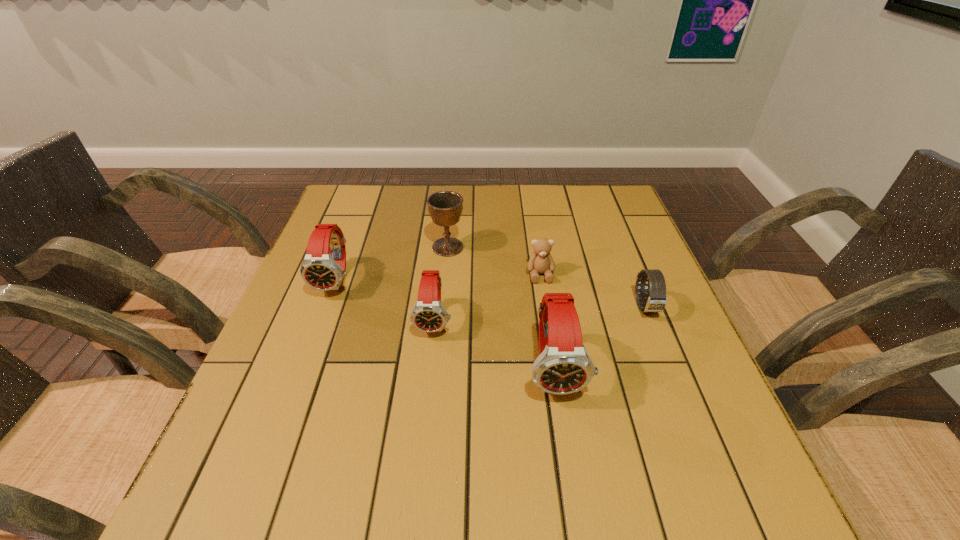
Locate an element on the screen. The image size is (960, 540). vacant space at the right edge of the desktop is located at coordinates (663, 311).

The image size is (960, 540). What are the coordinates of `vacant space at the far left corner of the desktop` in the screenshot? It's located at (364, 184).

Image resolution: width=960 pixels, height=540 pixels. In order to click on free space at the near left corner of the desktop in this screenshot , I will do `click(283, 420)`.

In the image, there is a desktop. At what (x,y) coordinates should I click in order to perform the action: click on vacant area at the far right corner. Please return your answer as a coordinate pair (x, y). Looking at the image, I should click on (629, 210).

Where is `free space between the third tallest watch and the teddy bear`? The height and width of the screenshot is (540, 960). free space between the third tallest watch and the teddy bear is located at coordinates (488, 298).

Find the location of `empty space that is in between the leftmost watch and the farthest object`. empty space that is in between the leftmost watch and the farthest object is located at coordinates click(393, 264).

This screenshot has height=540, width=960. I want to click on free spot between the teddy bear and the rightmost object, so click(593, 291).

The height and width of the screenshot is (540, 960). In order to click on vacant area between the rightmost watch and the leftmost object in this screenshot , I will do `click(492, 294)`.

Locate an element on the screen. vacant space that's between the farthest object and the third watch from left to right is located at coordinates (501, 308).

Identify the location of free spot between the second watch from left to right and the teddy bear. This screenshot has height=540, width=960. (488, 298).